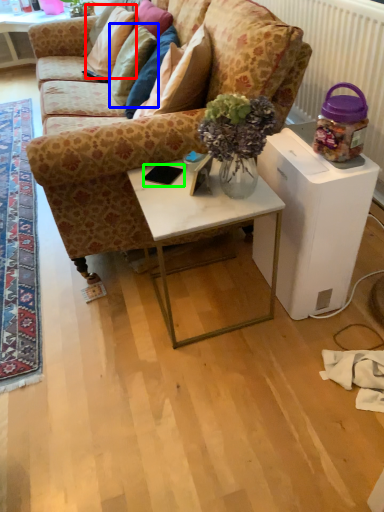
Question: Based on their relative distances, which object is farther from pillow (highlighted by a red box)? Choose from pillow (highlighted by a blue box) and mobile phone (highlighted by a green box).

Choices:
 (A) pillow
 (B) mobile phone

Answer: (B)